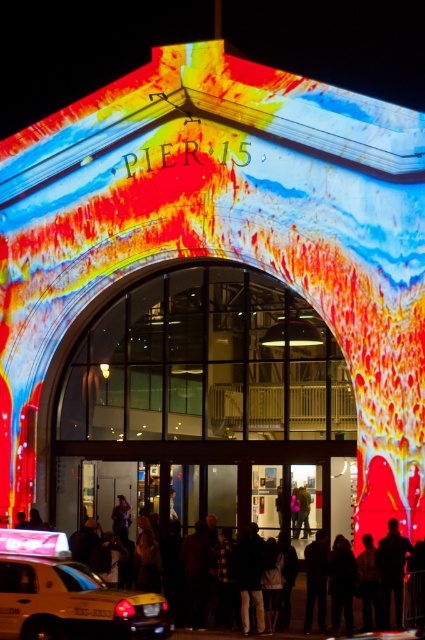
Question: Is yellow matte taxi at lower left wider than black matte person at lower right?

Choices:
 (A) no
 (B) yes

Answer: (B)

Question: Is yellow matte taxi at lower left above black matte person at lower right?

Choices:
 (A) no
 (B) yes

Answer: (A)

Question: Is yellow matte taxi at lower left to the left of black matte person at lower right from the viewer's perspective?

Choices:
 (A) yes
 (B) no

Answer: (A)

Question: Which object appears closest to the camera in this image?

Choices:
 (A) black matte person at lower right
 (B) yellow matte taxi at lower left

Answer: (B)